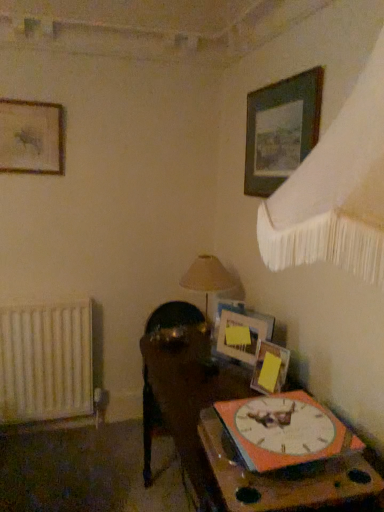
The height and width of the screenshot is (512, 384). What do you see at coordinates (189, 395) in the screenshot?
I see `wooden table at lower right, which ranks as the first table in bottom-to-top order` at bounding box center [189, 395].

Where is `wooden picture frame at upper left, positioned as the fourth picture frame in right-to-left order`? wooden picture frame at upper left, positioned as the fourth picture frame in right-to-left order is located at coordinates (31, 137).

Where is `white matte radiator at left`? white matte radiator at left is located at coordinates coord(46,362).

This screenshot has height=512, width=384. What do you see at coordinates (281, 129) in the screenshot? I see `wooden picture frame at upper right, which is the fourth picture frame from left to right` at bounding box center [281, 129].

I want to click on wooden picture frame at center, which ranks as the second picture frame in right-to-left order, so click(275, 368).

You are a GUI agent. You are given a task and a screenshot of the screen. Output one action in this format:
    pyautogui.click(x=<x>, y=<y>)
    Task: Click on the matte wooden picture frame at upper right, which is counted as the second picture frame, starting from the left
    This screenshot has height=512, width=384.
    Given the screenshot: What is the action you would take?
    pyautogui.click(x=249, y=331)

Is wooden picture frame at upper left, positioned as the fourth picture frame in right-to-left order, oriented away from wooden picture frame at upper right, which is the fourth picture frame from left to right?

No, wooden picture frame at upper left, positioned as the fourth picture frame in right-to-left order, is not facing the opposite direction of wooden picture frame at upper right, which is the fourth picture frame from left to right.

Is wooden picture frame at upper left, acting as the first picture frame starting from the top, to the left or to the right of wooden picture frame at upper right, placed as the 2th picture frame when sorted from top to bottom, in the image?

wooden picture frame at upper left, acting as the first picture frame starting from the top, is to the left of wooden picture frame at upper right, placed as the 2th picture frame when sorted from top to bottom.

Considering the sizes of wooden picture frame at upper left, the fourth picture frame from the bottom, and wooden picture frame at upper right, placed as the 2th picture frame when sorted from top to bottom, in the image, is wooden picture frame at upper left, the fourth picture frame from the bottom, wider or thinner than wooden picture frame at upper right, placed as the 2th picture frame when sorted from top to bottom,?

In the image, wooden picture frame at upper left, the fourth picture frame from the bottom, appears to be wider than wooden picture frame at upper right, placed as the 2th picture frame when sorted from top to bottom.

What's the angular difference between wooden picture frame at center, the first picture frame from the bottom, and wooden table at lower right, which ranks as the first table in bottom-to-top order,'s facing directions?

The facing directions of wooden picture frame at center, the first picture frame from the bottom, and wooden table at lower right, which ranks as the first table in bottom-to-top order, are 24.4 degrees apart.

From the image's perspective, is wooden picture frame at center, which is the 4th picture frame from top to bottom, below wooden table at lower right, the 2th table positioned from the top?

Incorrect, from the image's perspective, wooden picture frame at center, which is the 4th picture frame from top to bottom, is higher than wooden table at lower right, the 2th table positioned from the top.

Does point (284, 357) appear closer or farther from the camera than point (200, 335)?

Clearly, point (284, 357) is closer to the camera than point (200, 335).

Is wooden picture frame at center, which ranks as the second picture frame in right-to-left order, facing away from wooden table at lower right, which ranks as the first table in bottom-to-top order?

No.

Is wooden clock at lower right, which is counted as the 1th table, starting from the top, touching wooden picture frame at center, which is counted as the 3th picture frame, starting from the left?

They are not placed beside each other.

Consider the image. From a real-world perspective, is wooden clock at lower right, acting as the 2th table starting from the bottom, over wooden picture frame at center, which is the 4th picture frame from top to bottom?

No, from a real-world perspective, wooden clock at lower right, acting as the 2th table starting from the bottom, is not over wooden picture frame at center, which is the 4th picture frame from top to bottom

The width and height of the screenshot is (384, 512). I want to click on the 1st table below when counting from the wooden picture frame at center, which is counted as the 3th picture frame, starting from the left (from the image's perspective), so click(285, 477).

Can we say wooden picture frame at upper right, which is the fourth picture frame from left to right, lies outside wooden table at lower right, the 2th table positioned from the top?

Yes, wooden picture frame at upper right, which is the fourth picture frame from left to right, is not within wooden table at lower right, the 2th table positioned from the top.

Considering the relative sizes of wooden picture frame at upper right, the 1th picture frame when ordered from right to left, and wooden table at lower right, which ranks as the first table in bottom-to-top order, in the image provided, is wooden picture frame at upper right, the 1th picture frame when ordered from right to left, bigger than wooden table at lower right, which ranks as the first table in bottom-to-top order,?

No.

Based on the photo, from their relative heights in the image, would you say wooden picture frame at upper right, placed as the 2th picture frame when sorted from top to bottom, is taller or shorter than wooden table at lower right, the 2th table positioned from the top?

wooden picture frame at upper right, placed as the 2th picture frame when sorted from top to bottom, is shorter than wooden table at lower right, the 2th table positioned from the top.

Is wooden picture frame at upper right, the 1th picture frame when ordered from right to left, facing towards wooden table at lower right, which ranks as the first table in bottom-to-top order?

No.

Based on their positions, is beige fabric lampshade at center located to the left or right of matte wooden picture frame at upper right, arranged as the 3th picture frame when viewed from the top?

Based on their positions, beige fabric lampshade at center is located to the left of matte wooden picture frame at upper right, arranged as the 3th picture frame when viewed from the top.

Is beige fabric lampshade at center not close to matte wooden picture frame at upper right, arranged as the 3th picture frame when viewed from the top?

That's not correct — beige fabric lampshade at center is a little close to matte wooden picture frame at upper right, arranged as the 3th picture frame when viewed from the top.

Is beige fabric lampshade at center aimed at matte wooden picture frame at upper right, the 2th picture frame in the bottom-to-top sequence?

No, beige fabric lampshade at center is not turned towards matte wooden picture frame at upper right, the 2th picture frame in the bottom-to-top sequence.

Is beige fabric lampshade at center surrounding matte wooden picture frame at upper right, arranged as the 3th picture frame when viewed from the top?

No, matte wooden picture frame at upper right, arranged as the 3th picture frame when viewed from the top, is not a part of beige fabric lampshade at center.

From the picture: Is wooden clock at lower right, which is counted as the 1th table, starting from the top, turned away from wooden picture frame at upper right, placed as the 2th picture frame when sorted from top to bottom?

wooden clock at lower right, which is counted as the 1th table, starting from the top, does not have its back to wooden picture frame at upper right, placed as the 2th picture frame when sorted from top to bottom.

In the image, is wooden clock at lower right, acting as the 2th table starting from the bottom, positioned in front of or behind wooden picture frame at upper right, which is the fourth picture frame from left to right?

Clearly, wooden clock at lower right, acting as the 2th table starting from the bottom, is in front of wooden picture frame at upper right, which is the fourth picture frame from left to right.

Is there a large distance between wooden clock at lower right, which is counted as the 1th table, starting from the top, and wooden picture frame at upper right, placed as the 2th picture frame when sorted from top to bottom?

Indeed, wooden clock at lower right, which is counted as the 1th table, starting from the top, is not near wooden picture frame at upper right, placed as the 2th picture frame when sorted from top to bottom.

Is wooden picture frame at upper right, placed as the 2th picture frame when sorted from top to bottom, positioned beyond the bounds of white matte radiator at left?

Indeed, wooden picture frame at upper right, placed as the 2th picture frame when sorted from top to bottom, is completely outside white matte radiator at left.

From the picture: From the image's perspective, is wooden picture frame at upper right, the third picture frame in the bottom-to-top sequence, located beneath white matte radiator at left?

Incorrect, from the image's perspective, wooden picture frame at upper right, the third picture frame in the bottom-to-top sequence, is higher than white matte radiator at left.

Considering the sizes of wooden picture frame at upper right, which is the fourth picture frame from left to right, and white matte radiator at left in the image, is wooden picture frame at upper right, which is the fourth picture frame from left to right, bigger or smaller than white matte radiator at left?

In the image, wooden picture frame at upper right, which is the fourth picture frame from left to right, appears to be smaller than white matte radiator at left.

Does wooden picture frame at upper right, the 1th picture frame when ordered from right to left, lie behind white matte radiator at left?

No, wooden picture frame at upper right, the 1th picture frame when ordered from right to left, is closer to the camera.

From a real-world perspective, count 1st picture frames downward from the wooden picture frame at upper left, positioned as the fourth picture frame in right-to-left order, and point to it. Please provide its 2D coordinates.

[(281, 129)]

From the image's perspective, which table is the 2nd one below the wooden picture frame at center, which is the 4th picture frame from top to bottom? Please provide its 2D coordinates.

[(189, 395)]

Looking at the image, which one is located further to wooden table at lower right, which ranks as the first table in bottom-to-top order, wooden clock at lower right, acting as the 2th table starting from the bottom, or matte wooden picture frame at upper right, the 2th picture frame in the bottom-to-top sequence?

wooden clock at lower right, acting as the 2th table starting from the bottom, is positioned further to the anchor wooden table at lower right, which ranks as the first table in bottom-to-top order.

Estimate the real-world distances between objects in this image. Which object is closer to orange matte wall clock at lower right, beige fabric lampshade at center or wooden table at lower right, which ranks as the first table in bottom-to-top order?

The object closer to orange matte wall clock at lower right is wooden table at lower right, which ranks as the first table in bottom-to-top order.

Based on their spatial positions, is wooden picture frame at upper left, positioned as the fourth picture frame in right-to-left order, or orange matte wall clock at lower right further from beige fabric lampshade at center?

Based on the image, wooden picture frame at upper left, positioned as the fourth picture frame in right-to-left order, appears to be further to beige fabric lampshade at center.

Considering their positions, is wooden picture frame at upper right, which is the fourth picture frame from left to right, positioned closer to white matte radiator at left than matte wooden picture frame at upper right, which is counted as the second picture frame, starting from the left?

matte wooden picture frame at upper right, which is counted as the second picture frame, starting from the left.

Estimate the real-world distances between objects in this image. Which object is closer to wooden clock at lower right, acting as the 2th table starting from the bottom, orange matte wall clock at lower right or wooden picture frame at center, which is the 4th picture frame from top to bottom?

The object closer to wooden clock at lower right, acting as the 2th table starting from the bottom, is orange matte wall clock at lower right.

Which object lies further to the anchor point wooden table at lower right, which ranks as the first table in bottom-to-top order, wooden picture frame at center, which ranks as the second picture frame in right-to-left order, or wooden picture frame at upper right, placed as the 2th picture frame when sorted from top to bottom?

wooden picture frame at upper right, placed as the 2th picture frame when sorted from top to bottom, is further to wooden table at lower right, which ranks as the first table in bottom-to-top order.

From the image, which object appears to be nearer to wooden picture frame at upper left, positioned as the fourth picture frame in right-to-left order, wooden clock at lower right, which is counted as the 1th table, starting from the top, or beige fabric lampshade at center?

beige fabric lampshade at center lies closer to wooden picture frame at upper left, positioned as the fourth picture frame in right-to-left order, than the other object.

From the image, which object appears to be nearer to wooden picture frame at center, which ranks as the second picture frame in right-to-left order, orange matte wall clock at lower right or wooden clock at lower right, which is counted as the 1th table, starting from the top?

orange matte wall clock at lower right is closer to wooden picture frame at center, which ranks as the second picture frame in right-to-left order.

Locate an element on the screen. table between wooden table at lower right, which ranks as the first table in bottom-to-top order, and white matte radiator at left, along the z-axis is located at coordinates (285, 477).

Identify the location of table between wooden picture frame at upper left, acting as the first picture frame starting from the top, and white matte radiator at left in the up-down direction. (285, 477).

Locate an element on the screen. The height and width of the screenshot is (512, 384). wall clock between wooden picture frame at upper left, the 1th picture frame when ordered from left to right, and white matte radiator at left from top to bottom is located at coordinates (285, 431).

At what (x,y) coordinates should I click in order to perform the action: click on table between wooden table at lower right, which ranks as the first table in bottom-to-top order, and wooden picture frame at center, which is the 4th picture frame from top to bottom, in the front-back direction. Please return your answer as a coordinate pair (x, y). Looking at the image, I should click on (285, 477).